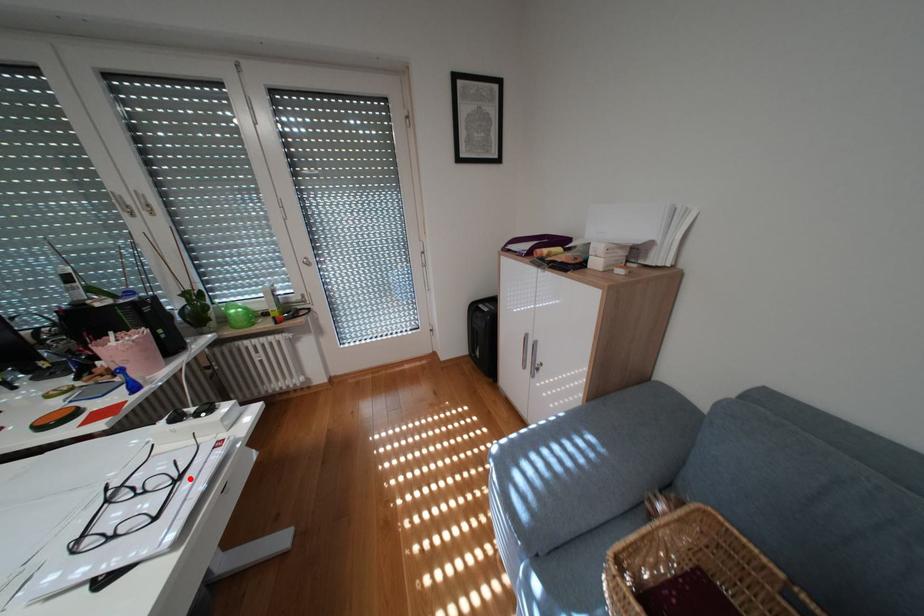
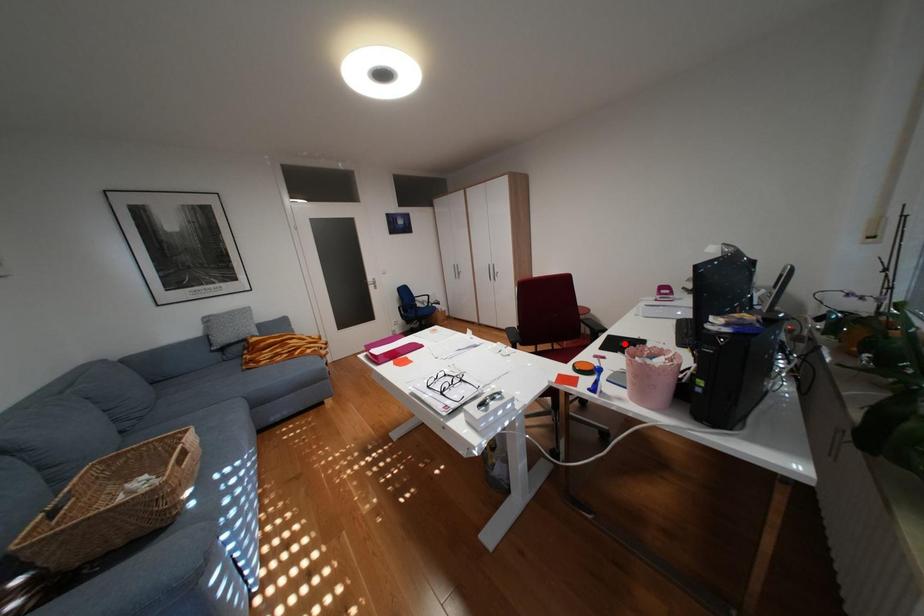
I am providing you with two images of the same scene from different viewpoints. A red point is marked on the first image and another point is marked on the second image. Does the point marked in image1 correspond to the same location as the one in image2?

No